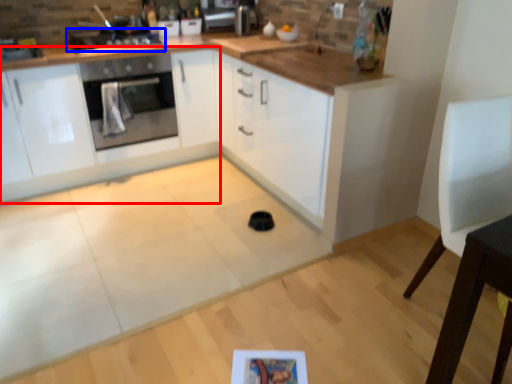
Question: Which object is closer to the camera taking this photo, cabinetry (highlighted by a red box) or kitchen appliance (highlighted by a blue box)?

Choices:
 (A) cabinetry
 (B) kitchen appliance

Answer: (A)